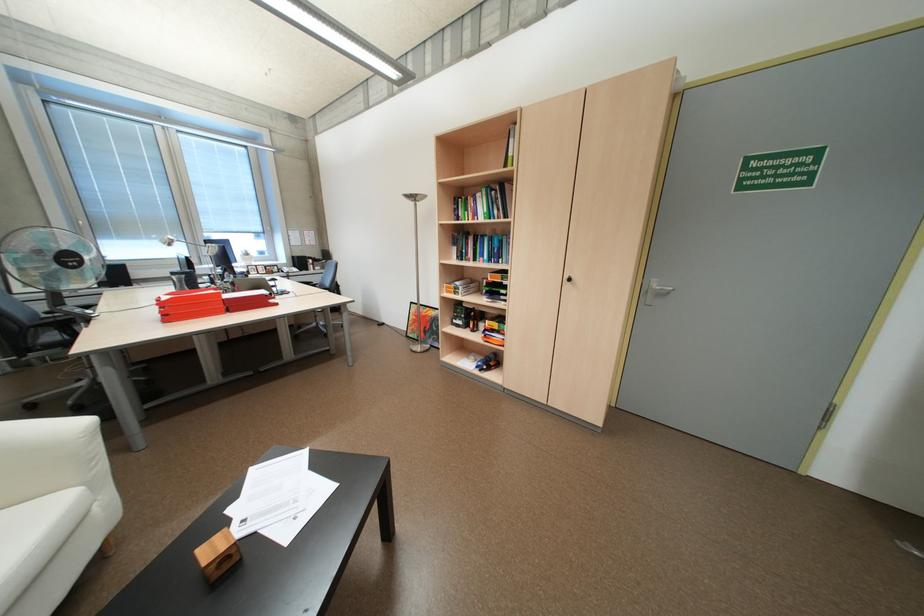
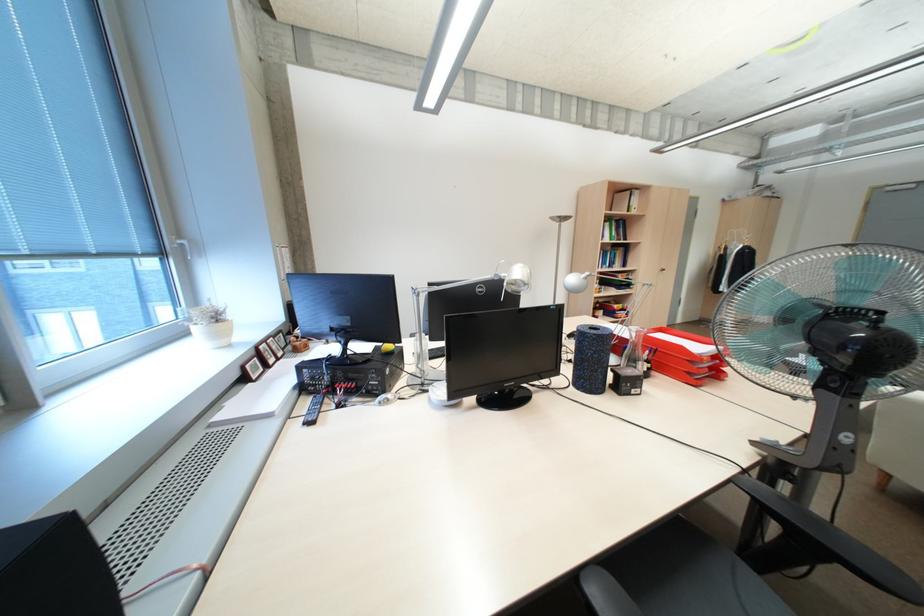
In the second image, find the point that corresponds to point (484, 214) in the first image.

(612, 236)